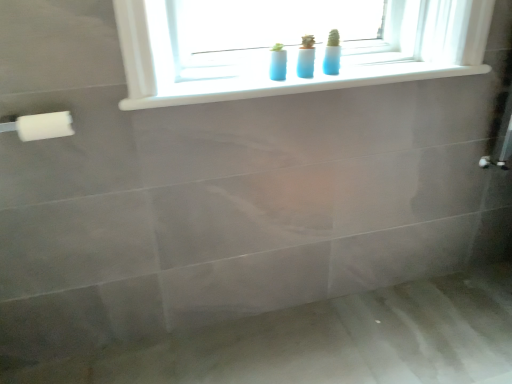
Question: Is white plastic window sill at upper center to the right of matte gray bath at lower center from the viewer's perspective?

Choices:
 (A) no
 (B) yes

Answer: (A)

Question: Is white plastic window sill at upper center positioned before matte gray bath at lower center?

Choices:
 (A) no
 (B) yes

Answer: (A)

Question: Does white plastic window sill at upper center have a smaller size compared to matte gray bath at lower center?

Choices:
 (A) no
 (B) yes

Answer: (B)

Question: Does white plastic window sill at upper center lie behind matte gray bath at lower center?

Choices:
 (A) no
 (B) yes

Answer: (B)

Question: Is white plastic window sill at upper center shorter than matte gray bath at lower center?

Choices:
 (A) yes
 (B) no

Answer: (B)

Question: Is white plastic window sill at upper center facing towards matte gray bath at lower center?

Choices:
 (A) yes
 (B) no

Answer: (B)

Question: Does matte gray bath at lower center turn towards white plastic window sill at upper center?

Choices:
 (A) no
 (B) yes

Answer: (A)

Question: Does matte gray bath at lower center lie behind white plastic window sill at upper center?

Choices:
 (A) no
 (B) yes

Answer: (A)

Question: Is matte gray bath at lower center beside white plastic window sill at upper center?

Choices:
 (A) yes
 (B) no

Answer: (B)

Question: Can you confirm if matte gray bath at lower center is wider than white plastic window sill at upper center?

Choices:
 (A) no
 (B) yes

Answer: (B)

Question: From the image's perspective, is matte gray bath at lower center above white plastic window sill at upper center?

Choices:
 (A) no
 (B) yes

Answer: (A)

Question: Considering the relative sizes of matte gray bath at lower center and white plastic window sill at upper center in the image provided, is matte gray bath at lower center taller than white plastic window sill at upper center?

Choices:
 (A) no
 (B) yes

Answer: (A)

Question: Would you say white plastic window sill at upper center is a long distance from white plastic towel bar at left?

Choices:
 (A) no
 (B) yes

Answer: (A)